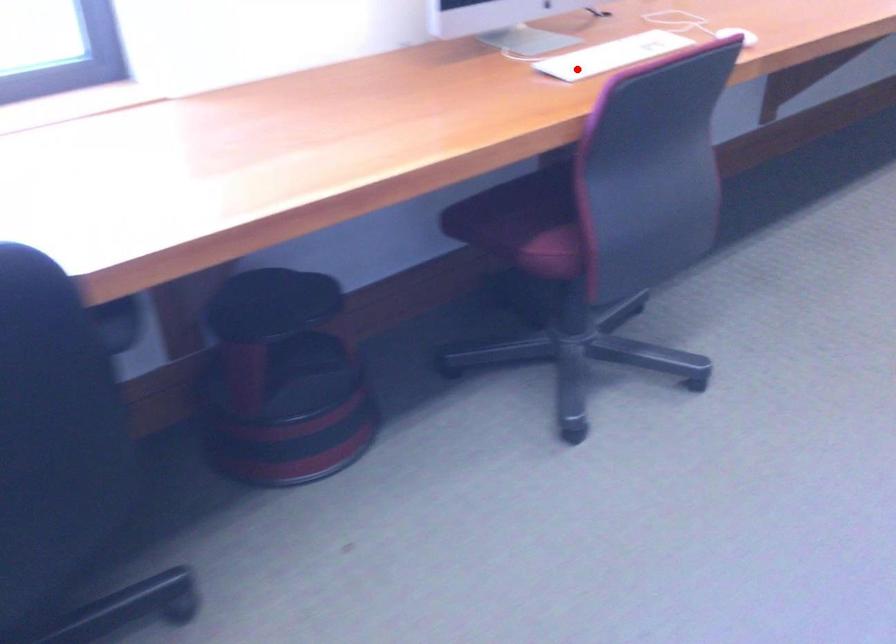
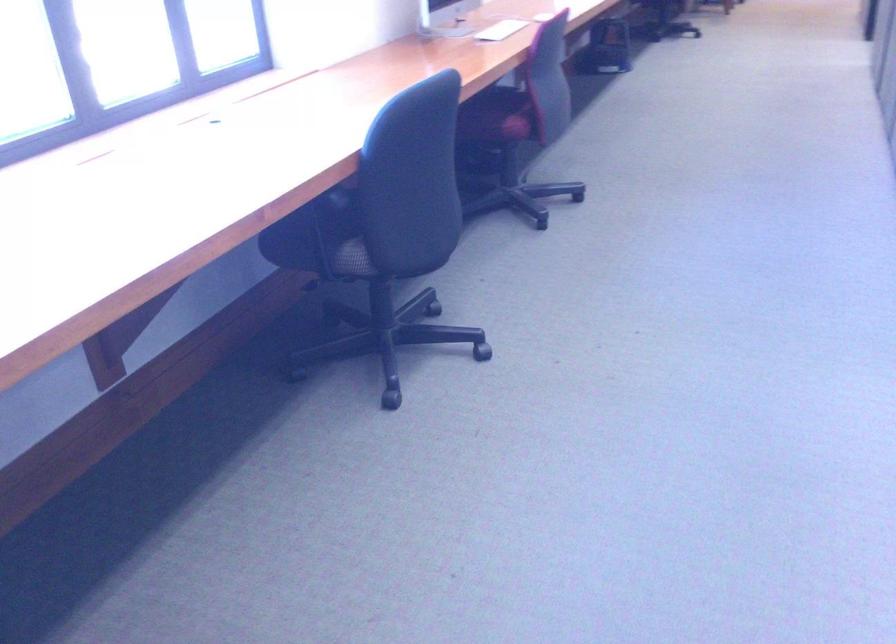
Question: A red point is marked in image1. In image2, is the corresponding 3D point closer to the camera or farther? Reply with the corresponding letter.

Choices:
 (A) The corresponding 3D point is closer.
 (B) The corresponding 3D point is farther.

Answer: (B)